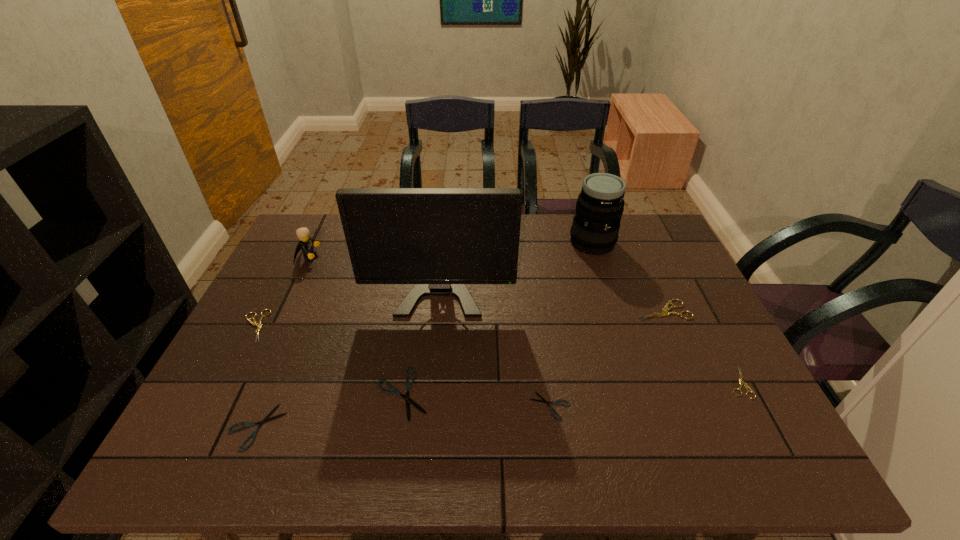
Identify the location of computer monitor. (439, 239).

Locate an element on the screen. the second tallest object is located at coordinates (600, 205).

Locate an element on the screen. Image resolution: width=960 pixels, height=540 pixels. Lego is located at coordinates (305, 244).

Where is `the tallest shears`? The height and width of the screenshot is (540, 960). the tallest shears is located at coordinates (664, 312).

Where is `the second beige shears from right to left`? the second beige shears from right to left is located at coordinates (664, 312).

Where is `the second biggest beige shears`? This screenshot has width=960, height=540. the second biggest beige shears is located at coordinates (259, 325).

Identify the location of the fifth tallest object. (259, 325).

You are a GUI agent. You are given a task and a screenshot of the screen. Output one action in this format:
    pyautogui.click(x=<x>, y=<y>)
    Task: Click on the second black shears from right to left
    
    Given the screenshot: What is the action you would take?
    pyautogui.click(x=408, y=384)

Locate an element on the screen. the biggest black shears is located at coordinates (408, 384).

The width and height of the screenshot is (960, 540). What are the coordinates of `the rightmost shears` in the screenshot? It's located at (740, 380).